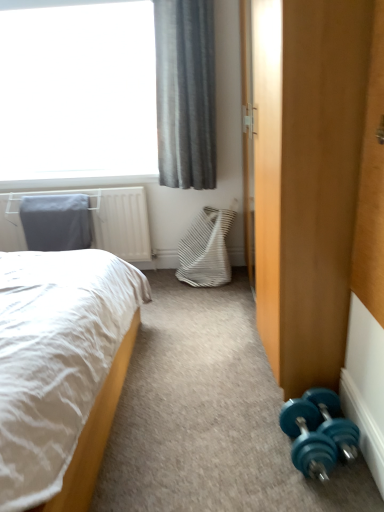
Where is `vacant region to the left of teal rubber dumbbell at lower right, the second dumbbell positioned from the right`? vacant region to the left of teal rubber dumbbell at lower right, the second dumbbell positioned from the right is located at coordinates (238, 451).